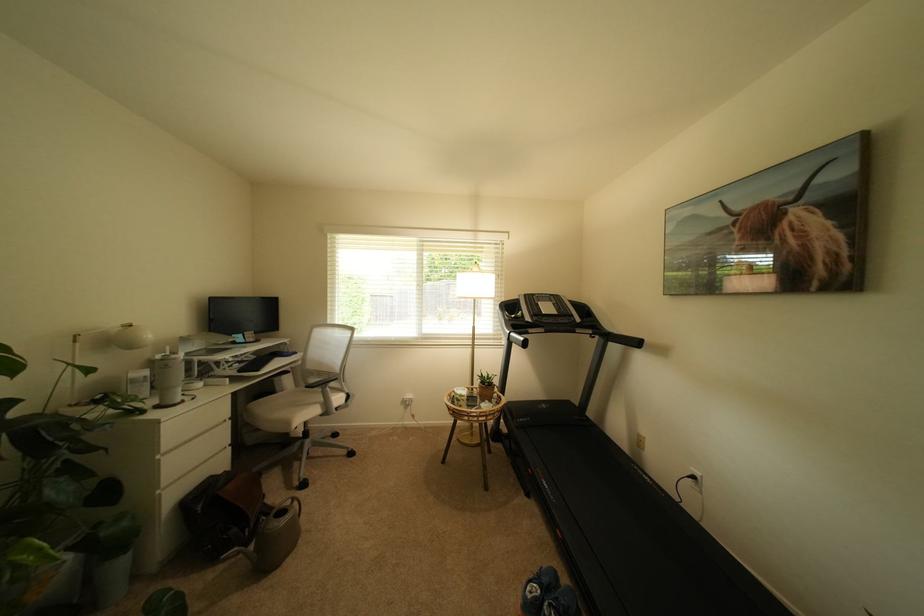
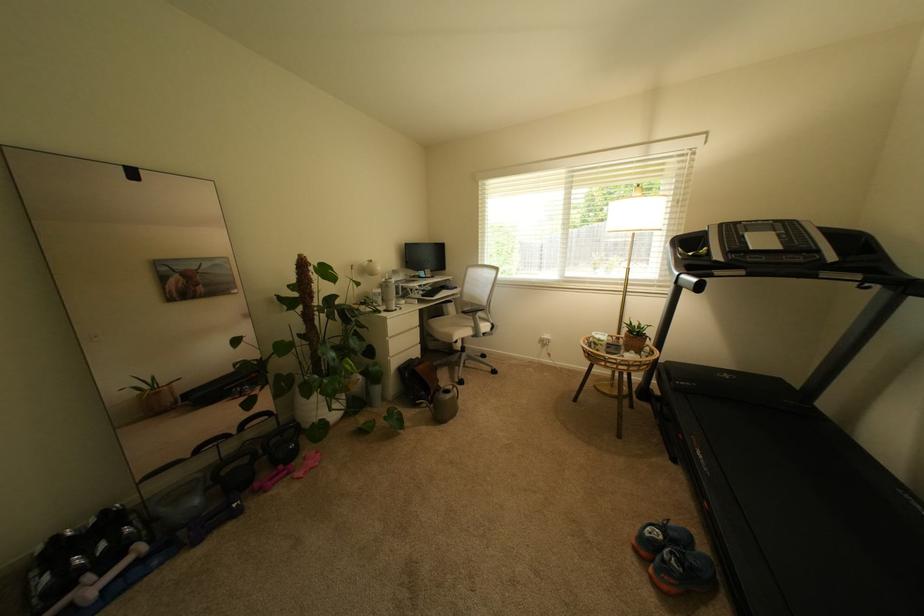
Find the pixel in the second image that matches [306,387] in the first image.

(466, 314)